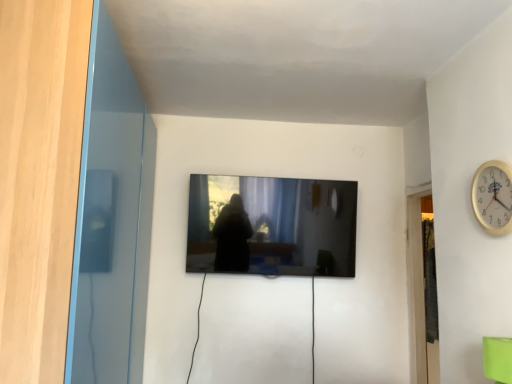
Question: Should I look upward or downward to see matte black tv at center?

Choices:
 (A) down
 (B) up

Answer: (A)

Question: Could you tell me if green matte cup at lower right is turned towards transparent glass door at left?

Choices:
 (A) no
 (B) yes

Answer: (B)

Question: Is green matte cup at lower right closer to the viewer compared to transparent glass door at left?

Choices:
 (A) no
 (B) yes

Answer: (A)

Question: From the image's perspective, would you say green matte cup at lower right is shown under transparent glass door at left?

Choices:
 (A) no
 (B) yes

Answer: (B)

Question: Is green matte cup at lower right next to transparent glass door at left?

Choices:
 (A) no
 (B) yes

Answer: (A)

Question: From the image's perspective, would you say green matte cup at lower right is positioned over transparent glass door at left?

Choices:
 (A) yes
 (B) no

Answer: (B)

Question: Is green matte cup at lower right smaller than transparent glass door at left?

Choices:
 (A) no
 (B) yes

Answer: (B)

Question: From the image's perspective, does matte black tv at center appear higher than green matte cup at lower right?

Choices:
 (A) no
 (B) yes

Answer: (B)

Question: From a real-world perspective, is matte black tv at center positioned under green matte cup at lower right based on gravity?

Choices:
 (A) no
 (B) yes

Answer: (A)

Question: Would you say green matte cup at lower right is part of matte black tv at center's contents?

Choices:
 (A) yes
 (B) no

Answer: (B)

Question: Considering the relative sizes of matte black tv at center and green matte cup at lower right in the image provided, is matte black tv at center wider than green matte cup at lower right?

Choices:
 (A) no
 (B) yes

Answer: (B)

Question: Does matte black tv at center lie in front of green matte cup at lower right?

Choices:
 (A) yes
 (B) no

Answer: (B)

Question: Is the position of matte black tv at center more distant than that of green matte cup at lower right?

Choices:
 (A) no
 (B) yes

Answer: (B)

Question: Is gold metallic wall clock at upper right bigger than matte black tv at center?

Choices:
 (A) no
 (B) yes

Answer: (A)